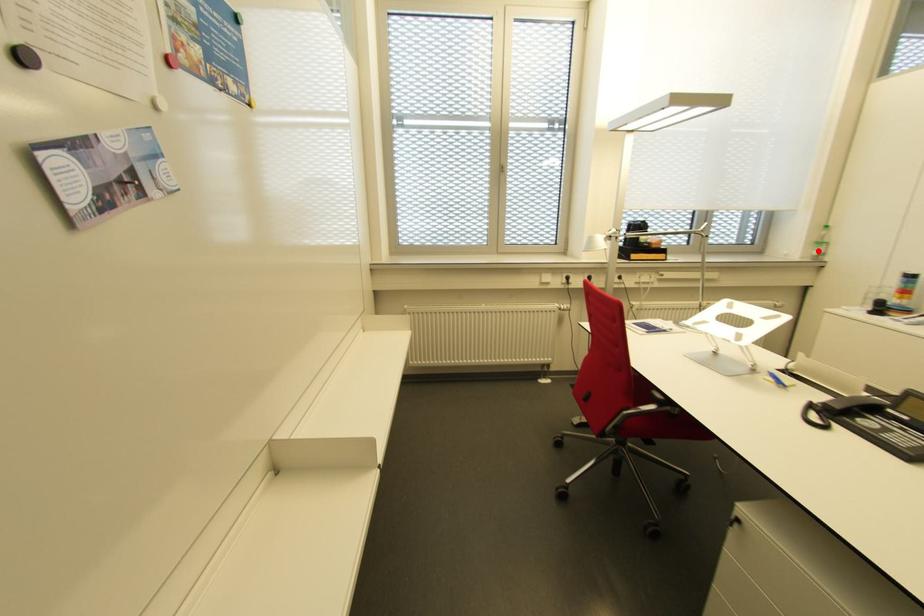
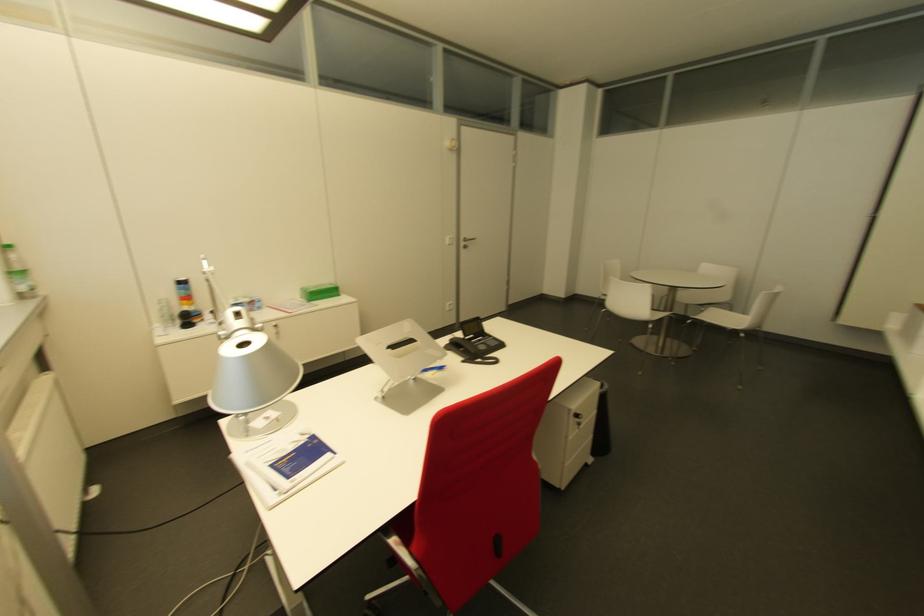
Find the pixel in the second image that matches the highlighted location in the first image.

(27, 284)